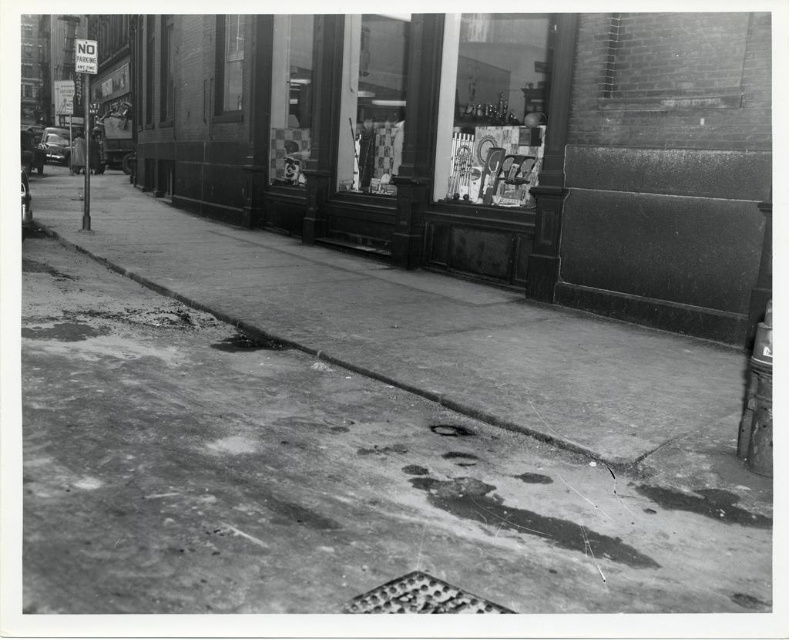
You are a delivery person trying to place a large package on the sidewalk. The package must be placed between the glass display case at upper center and the smooth concrete curb at lower center. Can you fit it there?

The glass display case at upper center is to the right of the smooth concrete curb at lower center, so there is space between them. However, the exact width isn not provided, so it depends on the package size.

You are a delivery person with a 6 meter long ladder that needs to be placed horizontally between the glass display case at upper center and the smooth concrete curb at lower center. Can the ladder fit without overlapping either object?

The distance between the glass display case at upper center and the smooth concrete curb at lower center is 5.25 meters. Since the ladder is 6 meters long, it cannot fit without overlapping one or both objects.